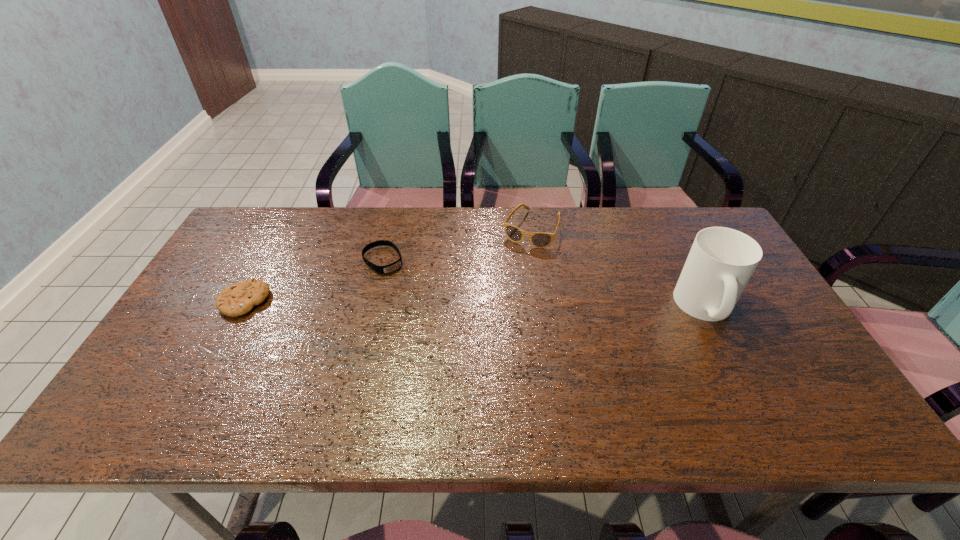
Identify the location of vacant region located 0.230m on the display of the wristband. (435, 319).

You are a GUI agent. You are given a task and a screenshot of the screen. Output one action in this format:
    pyautogui.click(x=<x>, y=<y>)
    Task: Click on the vacant space located on the display of the wristband
    The height and width of the screenshot is (540, 960).
    Given the screenshot: What is the action you would take?
    pyautogui.click(x=441, y=325)

Find the location of a particular element. The height and width of the screenshot is (540, 960). vacant space located on the front-facing side of the sunglasses is located at coordinates (512, 269).

Where is `free space located 0.280m on the front-facing side of the sunglasses`? This screenshot has width=960, height=540. free space located 0.280m on the front-facing side of the sunglasses is located at coordinates tap(492, 308).

The height and width of the screenshot is (540, 960). What are the coordinates of `vacant area situated 0.210m on the front-facing side of the sunglasses` in the screenshot? It's located at (500, 291).

Where is `wristband situated at the far edge`? wristband situated at the far edge is located at coordinates (389, 268).

Image resolution: width=960 pixels, height=540 pixels. What are the coordinates of `sunglasses that is at the far edge` in the screenshot? It's located at (538, 239).

Where is `object situated at the left edge`? This screenshot has width=960, height=540. object situated at the left edge is located at coordinates (237, 299).

The width and height of the screenshot is (960, 540). What are the coordinates of `object that is at the right edge` in the screenshot? It's located at (721, 261).

You are a GUI agent. You are given a task and a screenshot of the screen. Output one action in this format:
    pyautogui.click(x=<x>, y=<y>)
    Task: Click on the free region at the far edge of the desktop
    
    Given the screenshot: What is the action you would take?
    pyautogui.click(x=635, y=251)